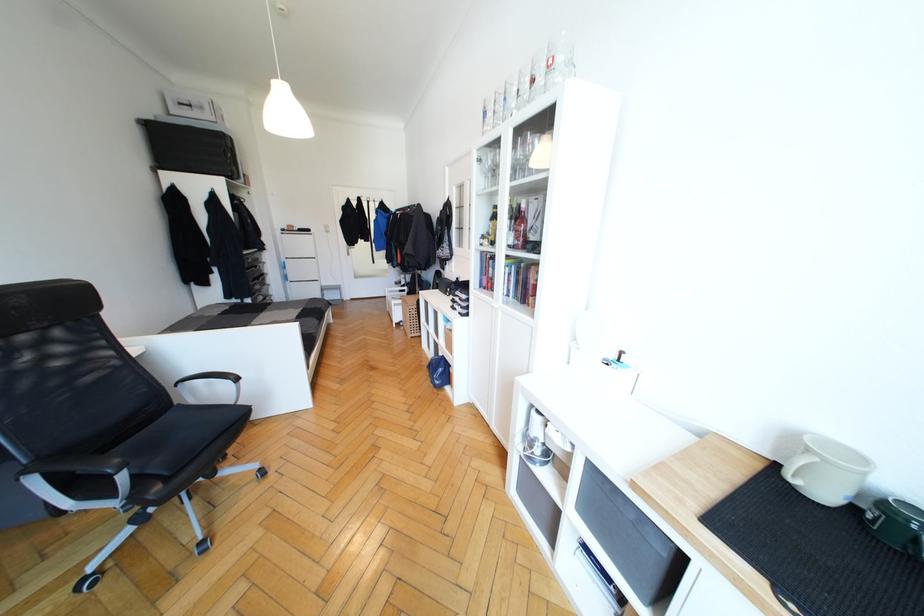
The height and width of the screenshot is (616, 924). In order to click on storage box handle in this screenshot , I will do `click(189, 103)`.